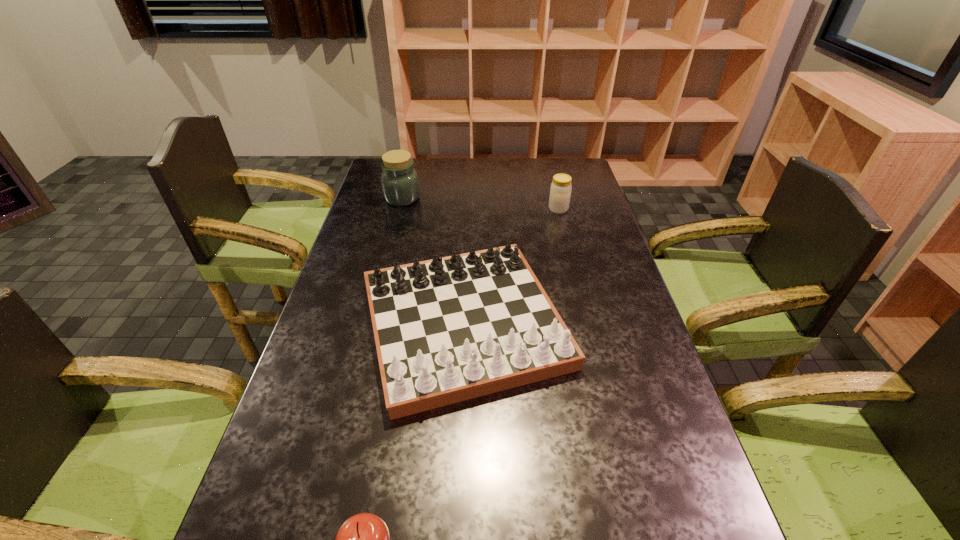
Image resolution: width=960 pixels, height=540 pixels. I want to click on object that is at the right edge, so click(560, 192).

In the image, there is a desktop. Identify the location of vacant space at the far edge. This screenshot has height=540, width=960. (485, 173).

At what (x,y) coordinates should I click in order to perform the action: click on vacant space at the left edge of the desktop. Please return your answer as a coordinate pair (x, y). The width and height of the screenshot is (960, 540). Looking at the image, I should click on pyautogui.click(x=269, y=452).

The width and height of the screenshot is (960, 540). I want to click on blank space at the right edge of the desktop, so click(x=616, y=294).

In the image, there is a desktop. At what (x,y) coordinates should I click in order to perform the action: click on free space at the far left corner. Please return your answer as a coordinate pair (x, y). Image resolution: width=960 pixels, height=540 pixels. Looking at the image, I should click on (413, 158).

Image resolution: width=960 pixels, height=540 pixels. I want to click on vacant space at the far right corner, so click(x=577, y=158).

Where is `free area in between the left jar and the shorter jar`? free area in between the left jar and the shorter jar is located at coordinates (480, 204).

Locate an element on the screen. object that is the second closest to the left jar is located at coordinates (560, 192).

Point out which object is positioned as the second nearest to the taller jar. Please provide its 2D coordinates. Your answer should be formatted as a tuple, i.e. [(x, y)], where the tuple contains the x and y coordinates of a point satisfying the conditions above.

[(560, 192)]

Image resolution: width=960 pixels, height=540 pixels. Identify the location of vacant region that satisfies the following two spatial constraints: 1. on the back side of the shorter jar; 2. on the left side of the second nearest object. (468, 209).